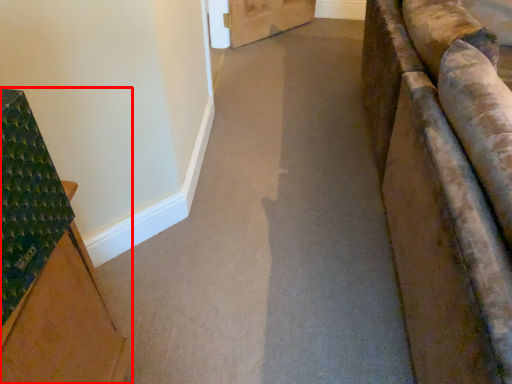
Question: From the image's perspective, what is the correct spatial relationship of furniture (annotated by the red box) in relation to path?

Choices:
 (A) above
 (B) below

Answer: (B)